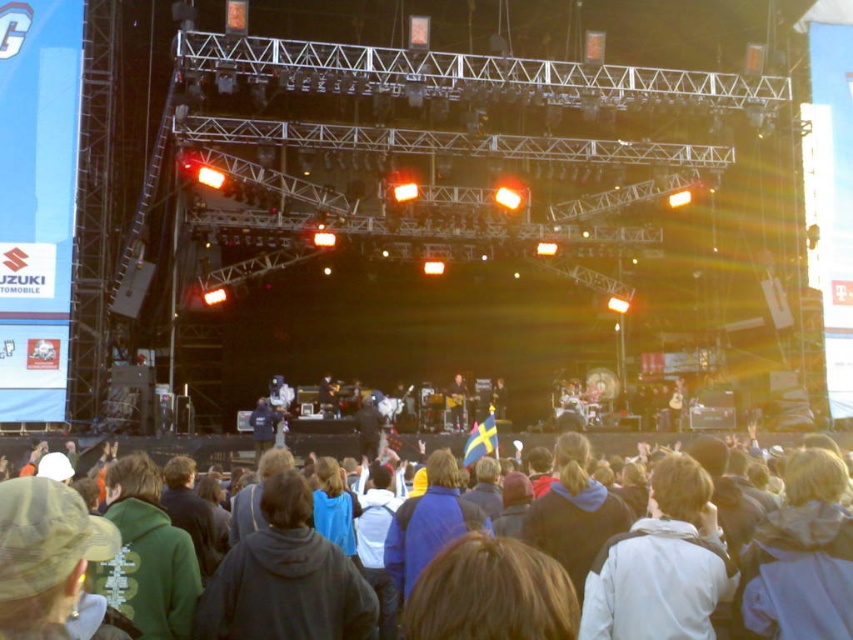
Does dark gray hoodie at center have a larger size compared to shiny black guitar at center?

Correct, dark gray hoodie at center is larger in size than shiny black guitar at center.

Is dark gray hoodie at center taller than shiny black guitar at center?

Incorrect, dark gray hoodie at center's height is not larger of shiny black guitar at center's.

Is point (329, 451) closer to viewer compared to point (460, 413)?

Yes, it is.

Where is `dark gray hoodie at center`? The width and height of the screenshot is (853, 640). dark gray hoodie at center is located at coordinates click(x=190, y=448).

Is white matte jacket at center to the left of dark blue jacket at center from the viewer's perspective?

Incorrect, white matte jacket at center is not on the left side of dark blue jacket at center.

Is point (669, 504) positioned after point (505, 406)?

No, (669, 504) is closer to viewer.

Who is more forward, (662, 465) or (502, 380)?

Point (662, 465) is in front.

The width and height of the screenshot is (853, 640). Find the location of `white matte jacket at center`. white matte jacket at center is located at coordinates (660, 564).

Is dark gray hoodie at center below dark blue jacket at center?

Correct, dark gray hoodie at center is located below dark blue jacket at center.

Can you confirm if dark gray hoodie at center is shorter than dark blue jacket at center?

Yes.

Describe the element at coordinates (190, 448) in the screenshot. The height and width of the screenshot is (640, 853). I see `dark gray hoodie at center` at that location.

The height and width of the screenshot is (640, 853). What are the coordinates of `dark gray hoodie at center` in the screenshot? It's located at (190, 448).